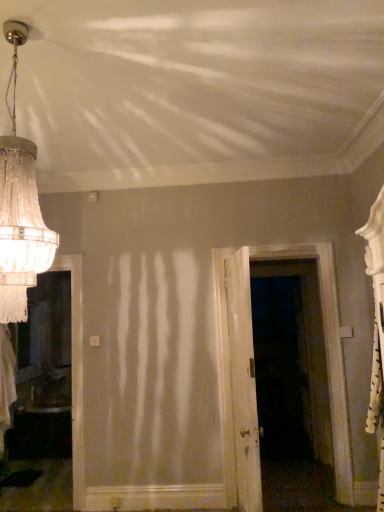
Question: Considering the positions of crystal glass chandelier at upper left and white wooden door at center, acting as the second door starting from the left, in the image, is crystal glass chandelier at upper left bigger or smaller than white wooden door at center, acting as the second door starting from the left,?

Choices:
 (A) big
 (B) small

Answer: (B)

Question: Is crystal glass chandelier at upper left spatially inside white wooden door at center, acting as the second door starting from the left, or outside of it?

Choices:
 (A) inside
 (B) outside

Answer: (B)

Question: Which object is positioned closest to the white wooden door at center, acting as the second door starting from the left?

Choices:
 (A) white wood door at center, which is counted as the first door, starting from the left
 (B) crystal glass chandelier at upper left

Answer: (A)

Question: Estimate the real-world distances between objects in this image. Which object is farther from the crystal glass chandelier at upper left?

Choices:
 (A) white wood door at center, the second door positioned from the right
 (B) white wooden door at center, acting as the second door starting from the left

Answer: (B)